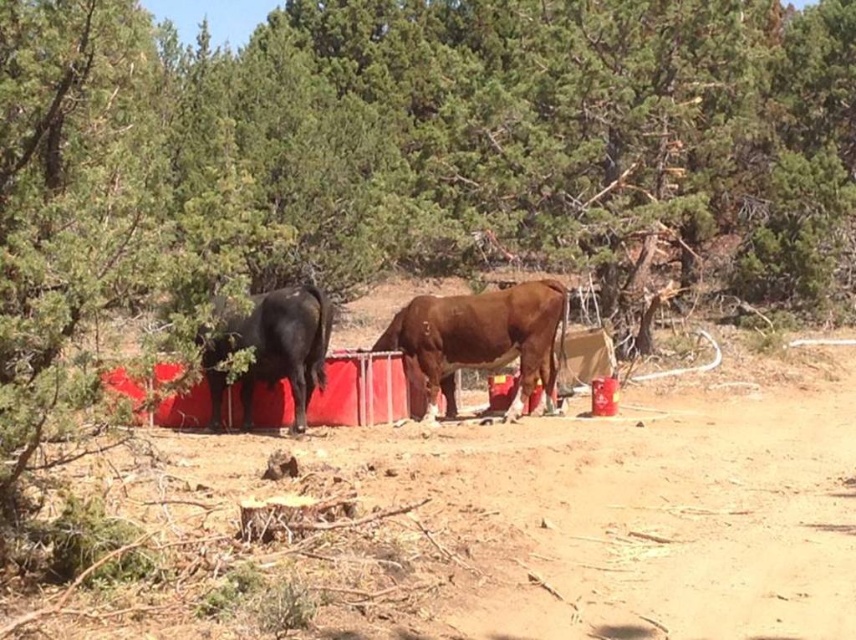
Is point (6, 602) farther from viewer compared to point (440, 336)?

No, it is not.

Does dirt field at center have a lesser height compared to brown matte cow at center?

Correct, dirt field at center is not as tall as brown matte cow at center.

Where is `dirt field at center`? dirt field at center is located at coordinates (494, 525).

Is dirt field at center thinner than shiny black bull at left?

No.

The height and width of the screenshot is (640, 856). Describe the element at coordinates (494, 525) in the screenshot. I see `dirt field at center` at that location.

At what (x,y) coordinates should I click in order to perform the action: click on dirt field at center. Please return your answer as a coordinate pair (x, y). Image resolution: width=856 pixels, height=640 pixels. Looking at the image, I should click on (494, 525).

Is brown matte cow at center to the right of shiny black bull at left from the viewer's perspective?

Indeed, brown matte cow at center is positioned on the right side of shiny black bull at left.

Is point (521, 380) positioned after point (268, 308)?

That is True.

Which is in front, point (538, 323) or point (253, 310)?

Positioned in front is point (253, 310).

Where is `brown matte cow at center`? brown matte cow at center is located at coordinates (480, 339).